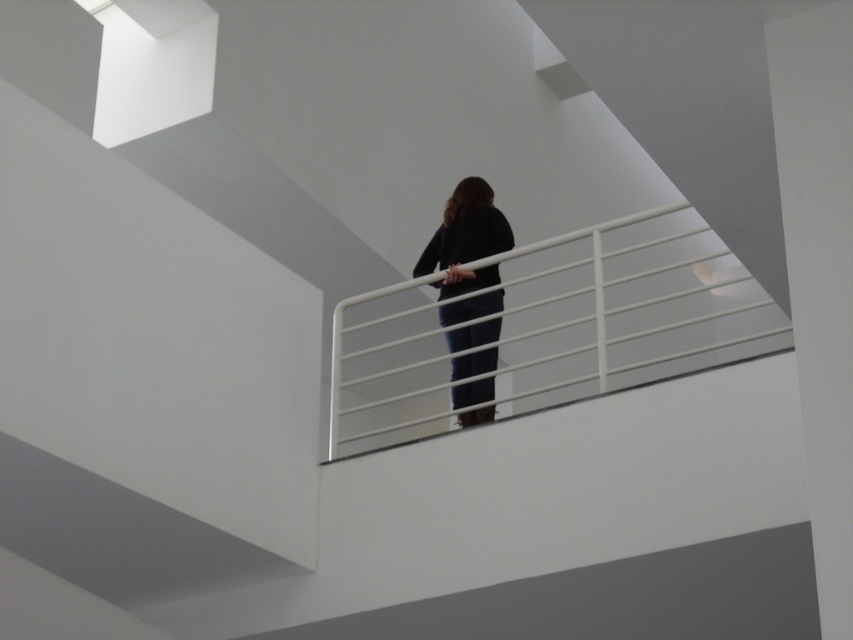
You are standing on the balcony and want to grab the white metal rail at upper center. Which direction should you move relative to your current position at the black matte pants at center?

The white metal rail at upper center is to the right of the black matte pants at center, so you should move to your right to grab it.

You are an interior designer planning to place a decorative sculpture between the white metal rail at upper center and the black matte pants at center. Based on their widths, which object should the sculpture be placed closer to?

The white metal rail at upper center might be wider than black matte pants at center, so the sculpture should be placed closer to the white metal rail at upper center to ensure proper spacing and visual balance.